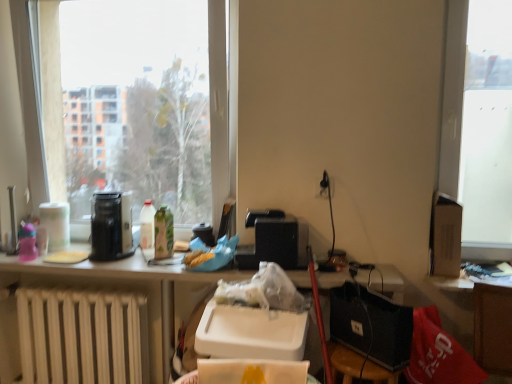
Question: From a real-world perspective, is white glossy bottle at center, placed as the second bottle when sorted from right to left, physically located above or below white matte radiator at lower left?

Choices:
 (A) above
 (B) below

Answer: (A)

Question: Does point (143, 233) appear closer or farther from the camera than point (138, 377)?

Choices:
 (A) farther
 (B) closer

Answer: (A)

Question: Estimate the real-world distances between objects in this image. Which object is farther from the matte black coffee maker at left, positioned as the first appliance in left-to-right order?

Choices:
 (A) green matte bottle at center, which appears as the 2th bottle when viewed from the left
 (B) matte black coffee maker at center, which is counted as the second appliance, starting from the left
 (C) wooden stool at lower right
 (D) matte cardboard box at upper right
 (E) white glossy bottle at center, placed as the second bottle when sorted from right to left

Answer: (D)

Question: Based on their relative distances, which object is nearer to the black plastic speaker at center?

Choices:
 (A) wooden stool at lower right
 (B) matte black coffee maker at left, which ranks as the 2th appliance in right-to-left order
 (C) matte black coffee maker at center, which is the first appliance in right-to-left order
 (D) white glossy bottle at center, placed as the second bottle when sorted from right to left
 (E) green matte bottle at center, the first bottle viewed from the right

Answer: (C)